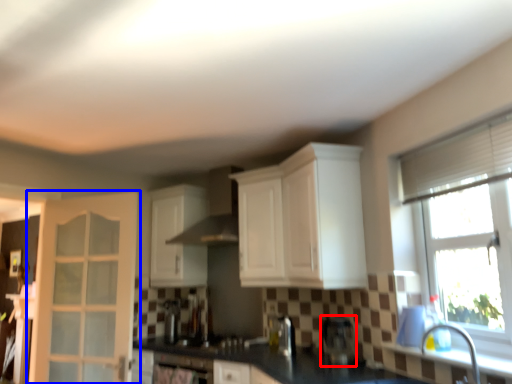
Question: Which object appears closest to the camera in this image, coffee machine (highlighted by a red box) or door (highlighted by a blue box)?

Choices:
 (A) coffee machine
 (B) door

Answer: (A)